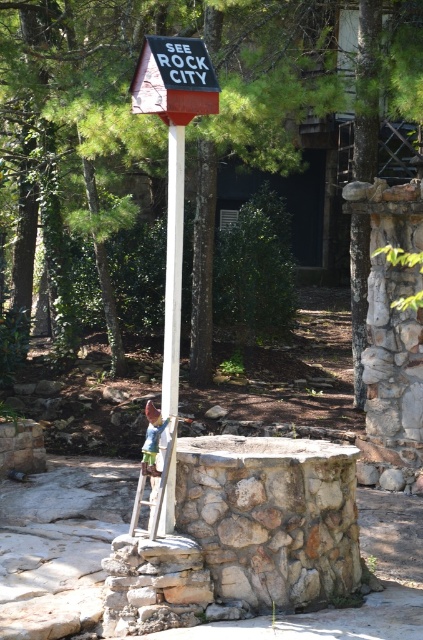
You are standing at the edge of the stone well and see the white plastic pole at center and the wooden at lower center. Which object is closer to your right side?

The white plastic pole at center is closer to your right side because it is positioned to the right of the wooden at lower center.

You are a tourist holding a map and standing near the red painted wood sign at center and the wooden at lower center. You need to determine which object is nearer to you. Which one is closer?

The red painted wood sign at center is closer to the viewer than the wooden at lower center.